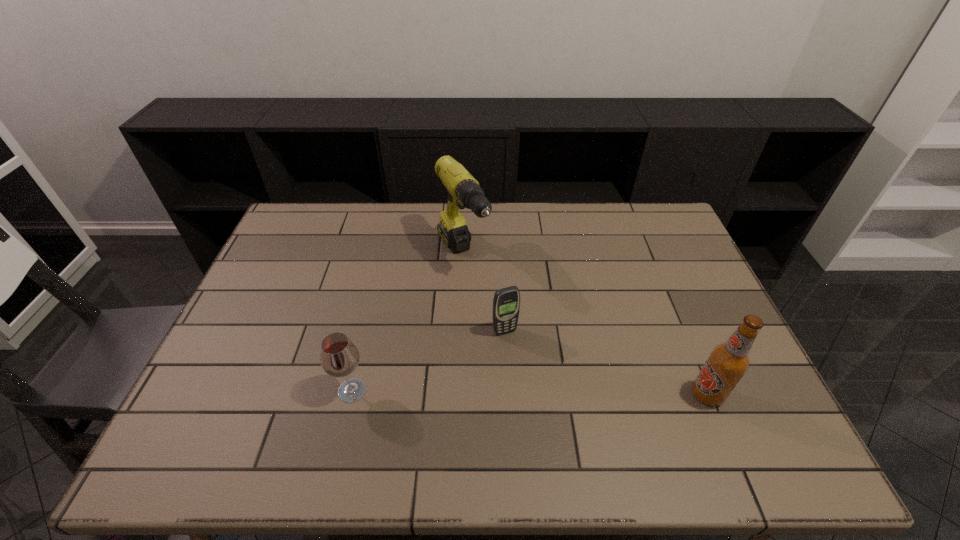
Locate an element on the screen. free point located 0.110m on the handle side of the drill is located at coordinates (491, 308).

Identify the location of free spot located on the handle side of the drill. (511, 337).

Where is `vacant space located 0.150m on the handle side of the drill`? Image resolution: width=960 pixels, height=540 pixels. vacant space located 0.150m on the handle side of the drill is located at coordinates (x=497, y=317).

Where is `vacant space located on the screen of the third nearest object`? vacant space located on the screen of the third nearest object is located at coordinates (525, 366).

In order to click on blank space located on the screen of the third nearest object in this screenshot , I will do `click(549, 413)`.

The height and width of the screenshot is (540, 960). Find the location of `free space located on the screen of the third nearest object`. free space located on the screen of the third nearest object is located at coordinates (521, 360).

Identify the location of object present at the far edge. (463, 189).

I want to click on wineglass present at the near edge, so click(339, 357).

I want to click on beer bottle present at the near edge, so click(x=727, y=363).

Image resolution: width=960 pixels, height=540 pixels. Find the location of `object present at the right edge`. object present at the right edge is located at coordinates (727, 363).